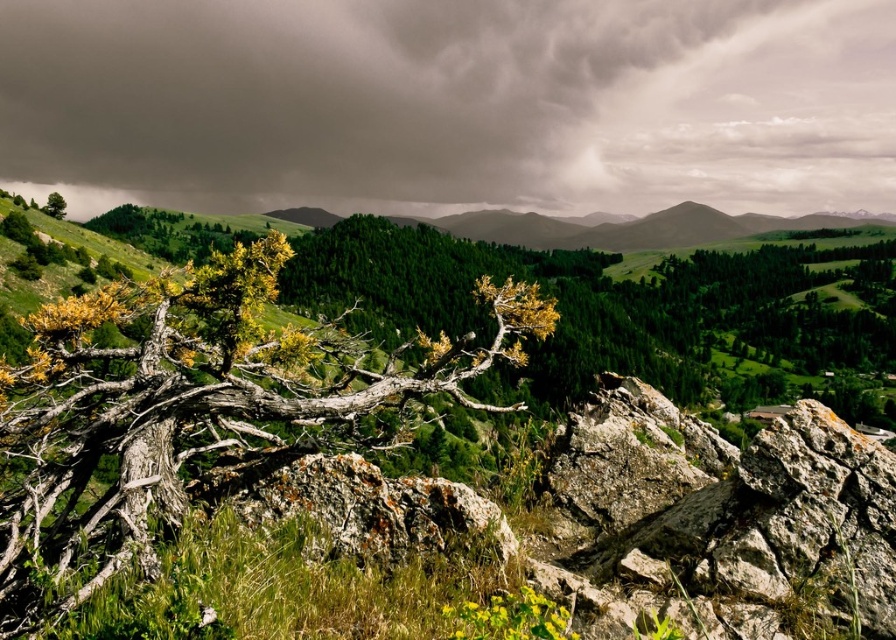
How far apart are rusty stone rock at lower right and rusty rock at center?

The distance of rusty stone rock at lower right from rusty rock at center is 10.70 feet.

Measure the distance between rusty stone rock at lower right and camera.

A distance of 5.56 meters exists between rusty stone rock at lower right and camera.

Where is `rusty stone rock at lower right`? rusty stone rock at lower right is located at coordinates (716, 520).

Is the position of gray bark tree at center more distant than that of green leafy tree at upper left?

That is False.

Can you confirm if gray bark tree at center is positioned to the left of green leafy tree at upper left?

In fact, gray bark tree at center is to the right of green leafy tree at upper left.

This screenshot has height=640, width=896. I want to click on gray bark tree at center, so click(192, 408).

Which is above, dark gray cloud at upper center or rusty rock at center?

dark gray cloud at upper center is above.

Measure the distance between dark gray cloud at upper center and camera.

They are 575.54 meters apart.

Measure the distance between point (485, 145) and camera.

595.07 meters

At what (x,y) coordinates should I click in order to perform the action: click on dark gray cloud at upper center. Please return your answer as a coordinate pair (x, y). This screenshot has height=640, width=896. Looking at the image, I should click on (451, 104).